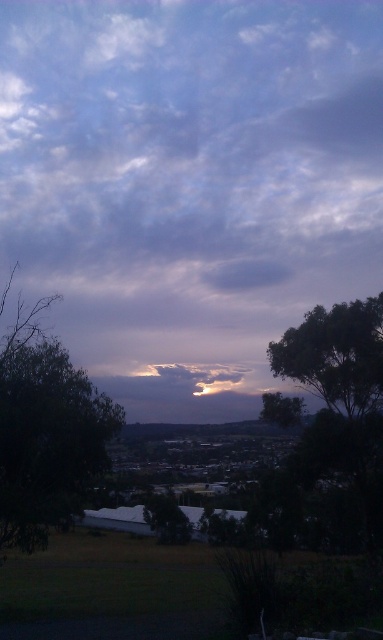
Question: In this image, where is dark green leafy tree at left located relative to green leafy tree at right?

Choices:
 (A) below
 (B) above

Answer: (B)

Question: Among these points, which one is farthest from the camera?

Choices:
 (A) (70, 49)
 (B) (183, 525)

Answer: (A)

Question: Which point is closer to the camera taking this photo?

Choices:
 (A) (181, 536)
 (B) (78, 442)
 (C) (304, 352)
 (D) (381, 470)

Answer: (B)

Question: Which object appears farthest from the camera in this image?

Choices:
 (A) dark green leafy tree at left
 (B) green leafy tree at right

Answer: (B)

Question: Is dark green leafy tree at right closer to the viewer compared to green leafy tree at center?

Choices:
 (A) yes
 (B) no

Answer: (A)

Question: Does cloudy sky at center appear under green leafy tree at right?

Choices:
 (A) yes
 (B) no

Answer: (B)